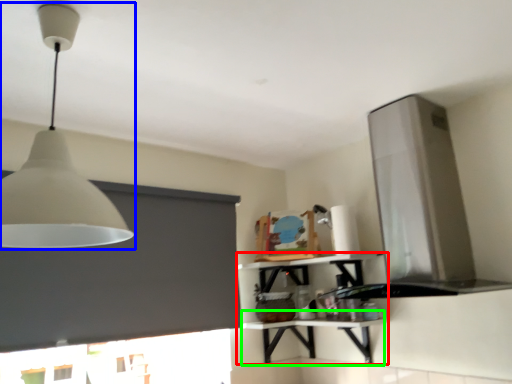
Question: Which object is positioned closest to shelf (highlighted by a red box)? Select from lamp (highlighted by a blue box) and table (highlighted by a green box).

Choices:
 (A) lamp
 (B) table

Answer: (B)